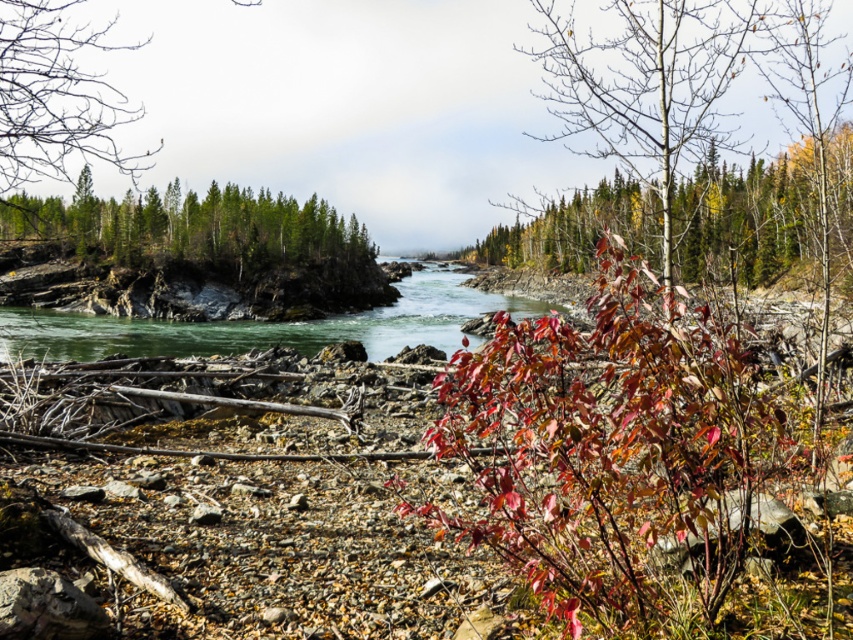
You are an artist planning to paint the scene. You want to ensure the leaves at upper right and the green matte trees at upper center are proportionally accurate. Which object should be drawn larger in your painting?

The leaves at upper right should be drawn larger than the green matte trees at upper center because the leaves at upper right is taller than green matte trees at upper center according to the description.